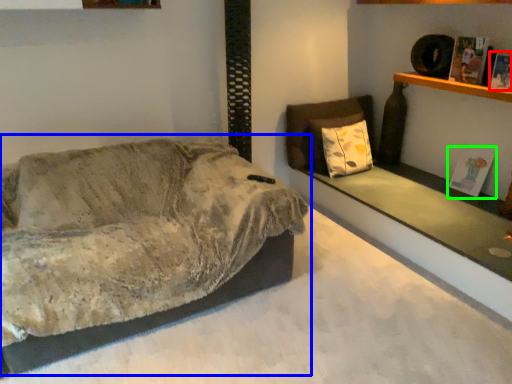
Question: Based on their relative distances, which object is farther from magazine (highlighted by a red box)? Choose from studio couch (highlighted by a blue box) and magazine (highlighted by a green box).

Choices:
 (A) studio couch
 (B) magazine

Answer: (A)